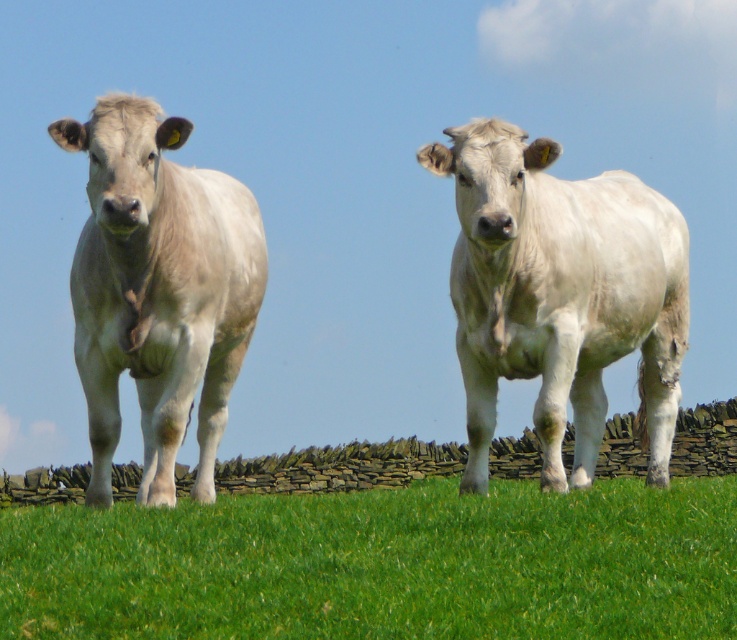
Looking at this image, you are a farmer who wants to locate the white matte cow at center in the image. According to the coordinates provided, where would you find it?

The white matte cow at center is located at the 2D coordinates point (559, 294).

You are a farmer who needs to identify which cow is larger between the white matte cow at center and the light gray smooth cow at center. Based on the scene, which one is bigger?

The white matte cow at center is bigger than the light gray smooth cow at center.